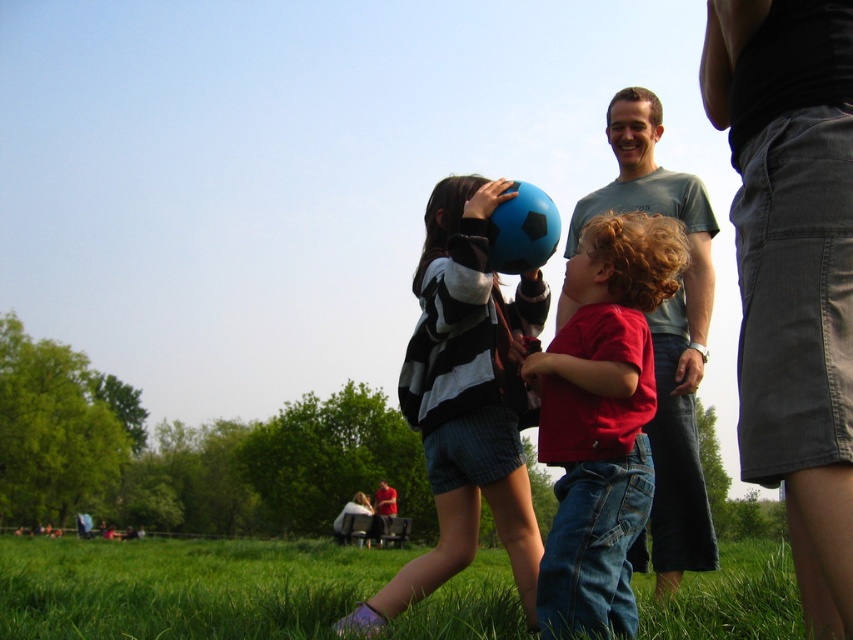
You are standing at the center of the park and want to place a picnic blanket on the green grass at lower center. According to the coordinates provided, where exactly should you place it?

The green grass at lower center is located at point (181, 588), so you should place the picnic blanket there.

You are standing at the point labeled as point (659,198) and want to throw a frisbee to someone at point (222,632). Considering the two points, will the frisbee fly over or around the children and adult male in the scene?

The point (222,632) is in front of point (659,198). Therefore, the frisbee thrown from point (659,198) towards point (222,632) will fly over the children and adult male since the target point is in front, meaning the path is directly towards them and above their heads.

You are a photographer trying to capture a photo of the black cotton skirt at upper right and the matte red shirt at center. Which object should you focus on first if you want to ensure both are in focus without adjusting the camera settings?

The black cotton skirt at upper right is taller than the matte red shirt at center. To ensure both are in focus, you should focus on the matte red shirt at center first since it is closer to the camera, allowing the depth of field to cover the taller object behind it.